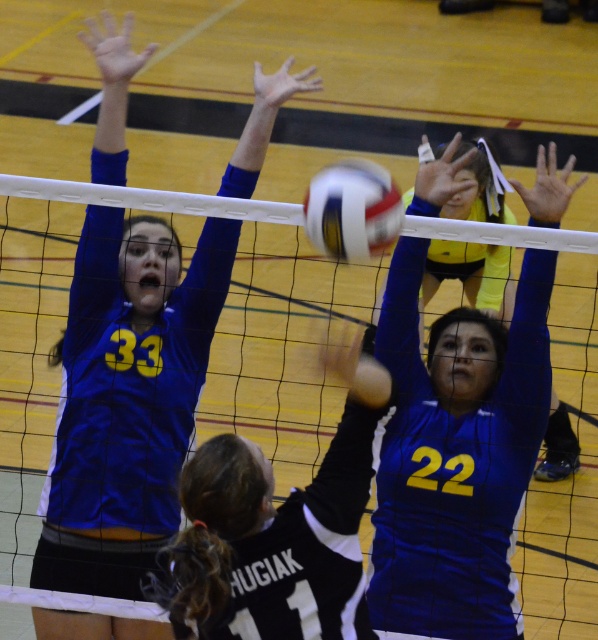
Question: Among these objects, which one is nearest to the camera?

Choices:
 (A) white matte volleyball at center
 (B) black jersey at center
 (C) matte blue jersey at upper left

Answer: (B)

Question: Is matte blue jersey at upper left above white matte volleyball at center?

Choices:
 (A) yes
 (B) no

Answer: (B)

Question: Can you confirm if blue jersey at center is smaller than white matte volleyball at center?

Choices:
 (A) yes
 (B) no

Answer: (B)

Question: Can you confirm if white mesh net at center is wider than blue jersey at center?

Choices:
 (A) no
 (B) yes

Answer: (A)

Question: Which point is farther to the camera?

Choices:
 (A) blue jersey at center
 (B) black jersey at center
 (C) white mesh net at center

Answer: (C)

Question: Among these objects, which one is nearest to the camera?

Choices:
 (A) blue jersey at center
 (B) matte blue jersey at upper left
 (C) white matte volleyball at center

Answer: (C)